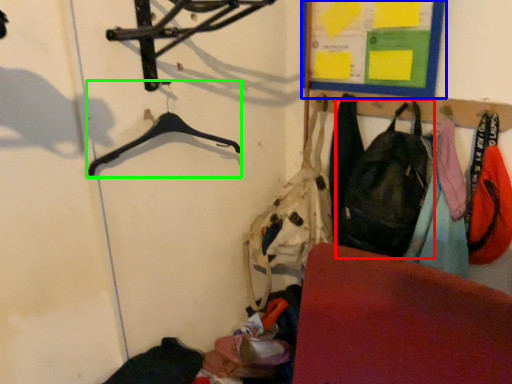
Question: Estimate the real-world distances between objects in this image. Which object is closer to shoulder bag (highlighted by a red box), bulletin board (highlighted by a blue box) or hanger (highlighted by a green box)?

Choices:
 (A) bulletin board
 (B) hanger

Answer: (A)